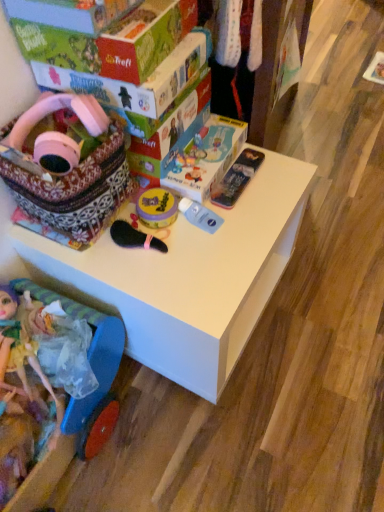
Question: Which direction should I rotate to look at transparent plastic bottle at center, positioned as the fifth toy in left-to-right order?

Choices:
 (A) right
 (B) left

Answer: (A)

Question: Is green cardboard box at upper left, which ranks as the 2th box in back-to-front order, oriented towards yellow matte jar at center, the 4th toy positioned from the left?

Choices:
 (A) no
 (B) yes

Answer: (A)

Question: From the image's perspective, is green cardboard box at upper left, which ranks as the 2th box in back-to-front order, beneath yellow matte jar at center, positioned as the 3th toy in right-to-left order?

Choices:
 (A) yes
 (B) no

Answer: (B)

Question: Is green cardboard box at upper left, which ranks as the 2th box in back-to-front order, not close to yellow matte jar at center, the 4th toy positioned from the left?

Choices:
 (A) no
 (B) yes

Answer: (A)

Question: Is green cardboard box at upper left, the 1th box in the front-to-back sequence, thinner than yellow matte jar at center, positioned as the 3th toy in right-to-left order?

Choices:
 (A) yes
 (B) no

Answer: (B)

Question: Is green cardboard box at upper left, which ranks as the 2th box in back-to-front order, positioned behind yellow matte jar at center, the 4th toy positioned from the left?

Choices:
 (A) no
 (B) yes

Answer: (A)

Question: Can you confirm if green cardboard box at upper left, which ranks as the 2th box in back-to-front order, is taller than yellow matte jar at center, positioned as the 3th toy in right-to-left order?

Choices:
 (A) yes
 (B) no

Answer: (A)

Question: Does plastic doll at lower left, placed as the sixth toy when sorted from right to left, have a lesser width compared to transparent plastic bottle at center, which is the second toy from right to left?

Choices:
 (A) yes
 (B) no

Answer: (B)

Question: Does plastic doll at lower left, which appears as the first toy when viewed from the left, lie in front of transparent plastic bottle at center, positioned as the fifth toy in left-to-right order?

Choices:
 (A) yes
 (B) no

Answer: (A)

Question: Would you say plastic doll at lower left, placed as the sixth toy when sorted from right to left, is outside transparent plastic bottle at center, positioned as the fifth toy in left-to-right order?

Choices:
 (A) no
 (B) yes

Answer: (B)

Question: Can you confirm if plastic doll at lower left, which appears as the first toy when viewed from the left, is positioned to the left of transparent plastic bottle at center, positioned as the fifth toy in left-to-right order?

Choices:
 (A) no
 (B) yes

Answer: (B)

Question: Does plastic doll at lower left, placed as the sixth toy when sorted from right to left, have a lesser height compared to transparent plastic bottle at center, which is the second toy from right to left?

Choices:
 (A) no
 (B) yes

Answer: (A)

Question: Can you confirm if plastic doll at lower left, which appears as the first toy when viewed from the left, is wider than transparent plastic bottle at center, positioned as the fifth toy in left-to-right order?

Choices:
 (A) yes
 (B) no

Answer: (A)

Question: Is transparent plastic bottle at center, which is the second toy from right to left, directly adjacent to pink matte headphones at upper left, the second toy viewed from the left?

Choices:
 (A) yes
 (B) no

Answer: (B)